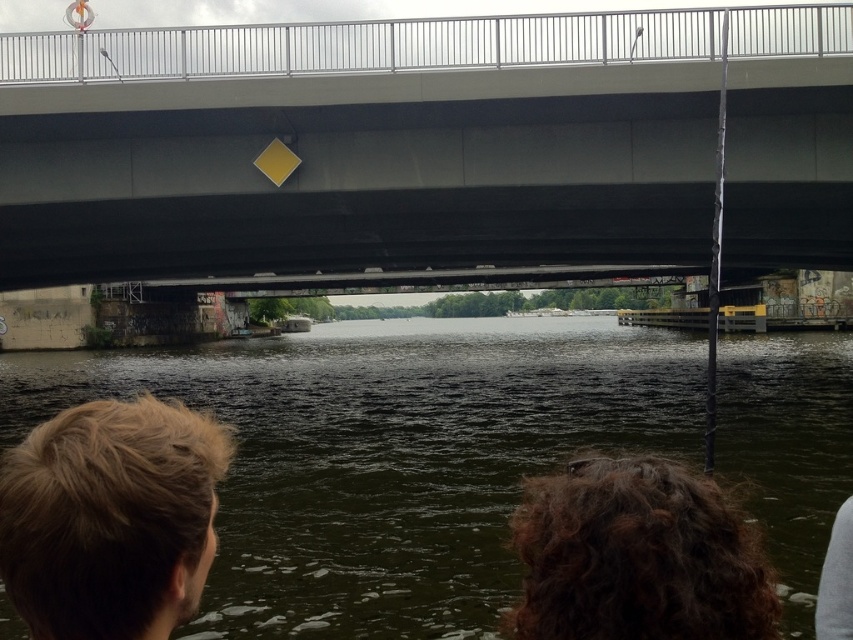
Question: Does smooth concrete bridge at center have a greater width compared to gray fabric at lower right?

Choices:
 (A) no
 (B) yes

Answer: (B)

Question: Which point is farther to the camera?

Choices:
 (A) (827, 468)
 (B) (634, 595)
 (C) (20, 253)

Answer: (C)

Question: Which of the following is the closest to the observer?

Choices:
 (A) gray fabric at lower right
 (B) blonde hair at lower left
 (C) dark green water at center
 (D) dark brown curly hair at lower center

Answer: (B)

Question: From the image, what is the correct spatial relationship of smooth concrete bridge at center in relation to blonde hair at lower left?

Choices:
 (A) left
 (B) right

Answer: (A)

Question: Does dark green water at center have a lesser width compared to dark brown curly hair at lower center?

Choices:
 (A) no
 (B) yes

Answer: (A)

Question: Which is farther from the dark brown curly hair at lower center?

Choices:
 (A) smooth concrete bridge at center
 (B) gray fabric at lower right
 (C) blonde hair at lower left

Answer: (A)